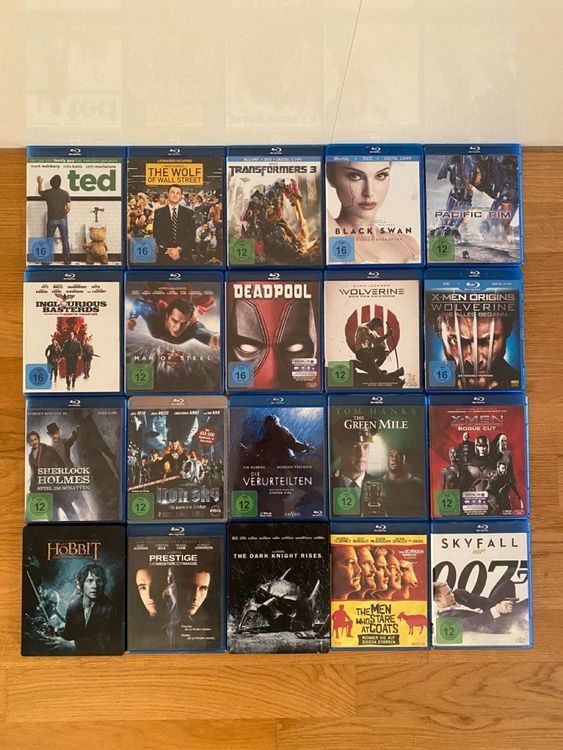
Identify the location of right row of dvds. Image resolution: width=563 pixels, height=750 pixels. (471, 576), (471, 472), (470, 338), (466, 208).